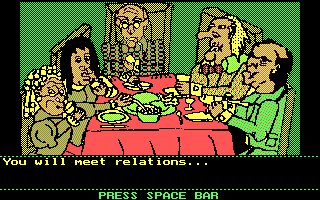
Where is `chair`? The image size is (320, 200). chair is located at coordinates (157, 23), (202, 18), (285, 123), (74, 33), (23, 123).